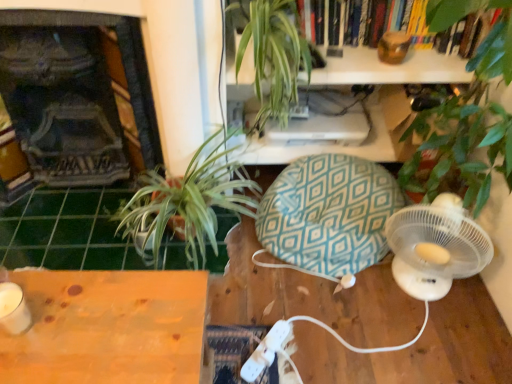
What do you see at coordinates (187, 204) in the screenshot?
I see `green leafy plant at left` at bounding box center [187, 204].

Describe the element at coordinates (274, 57) in the screenshot. I see `green leafy plant at upper center` at that location.

Locate an element on the screen. This screenshot has width=512, height=384. green leafy plant at upper center is located at coordinates (274, 57).

The height and width of the screenshot is (384, 512). What do you see at coordinates (78, 95) in the screenshot?
I see `dark gray stone fireplace at left` at bounding box center [78, 95].

You are a GUI agent. You are given a task and a screenshot of the screen. Output one action in this format:
    pyautogui.click(x=<x>, y=<y>)
    Task: Click on the wooden table at lower left
    This screenshot has height=384, width=512.
    Given the screenshot: What is the action you would take?
    pyautogui.click(x=108, y=327)

This screenshot has width=512, height=384. What are the coordinates of `green leafy plant at left` in the screenshot? It's located at (187, 204).

From a real-world perspective, is green leafy plant at upper center physically located above or below green leafy plant at left?

From a real-world perspective, green leafy plant at upper center is physically above green leafy plant at left.

In the scene shown: Is green leafy plant at upper center oriented away from green leafy plant at left?

No, green leafy plant at upper center is not facing away from green leafy plant at left.

Considering the sizes of objects green leafy plant at upper center and green leafy plant at left in the image provided, who is smaller, green leafy plant at upper center or green leafy plant at left?

With smaller size is green leafy plant at upper center.

How many degrees apart are the facing directions of green leafy plant at upper center and green leafy plant at left?

green leafy plant at upper center and green leafy plant at left are facing 0.678 degrees away from each other.

Considering the points (108, 210) and (261, 369), which point is in front, point (108, 210) or point (261, 369)?

The point (261, 369) is closer to the camera.

From a real-world perspective, which object rests below the other?

From a 3D spatial view, green tile at lower left is below.

The image size is (512, 384). I want to click on Wii controller on the right of green tile at lower left, so click(x=266, y=351).

How far apart are green tile at lower left and white plastic wii controller at lower center?

green tile at lower left is 77.84 centimeters from white plastic wii controller at lower center.

Is green leafy plant at left not close to teal diamond-patterned bean bag chair at center?

That's not correct — green leafy plant at left is a little close to teal diamond-patterned bean bag chair at center.

Which point is more distant from viewer, [146,193] or [321,243]?

Point [321,243]

Looking at this image, do you think green leafy plant at left is within teal diamond-patterned bean bag chair at center, or outside of it?

green leafy plant at left lies outside teal diamond-patterned bean bag chair at center.

Is green leafy plant at left to the left or to the right of teal diamond-patterned bean bag chair at center in the image?

Clearly, green leafy plant at left is on the left of teal diamond-patterned bean bag chair at center in the image.

Is point (241, 371) positioned after point (103, 177)?

No, it is in front of (103, 177).

Is white plastic wii controller at lower center wider or thinner than dark gray stone fireplace at left?

In the image, white plastic wii controller at lower center appears to be more narrow than dark gray stone fireplace at left.

From the image's perspective, which is above, white plastic wii controller at lower center or dark gray stone fireplace at left?

dark gray stone fireplace at left, from the image's perspective.

Is white plastic wii controller at lower center to the left of dark gray stone fireplace at left from the viewer's perspective?

Incorrect, white plastic wii controller at lower center is not on the left side of dark gray stone fireplace at left.

Is there a large distance between dark gray stone fireplace at left and white plastic fan at lower right?

Yes, dark gray stone fireplace at left and white plastic fan at lower right are quite far apart.

Between dark gray stone fireplace at left and white plastic fan at lower right, which one has larger width?

dark gray stone fireplace at left.

Is point (79, 144) positioned before point (412, 248)?

No, (79, 144) is behind (412, 248).

How different are the orientations of dark gray stone fireplace at left and white plastic fan at lower right in degrees?

The angular difference between dark gray stone fireplace at left and white plastic fan at lower right is 24.8 degrees.

Relative to green leafy plant at upper center, is wooden table at lower left in front or behind?

Clearly, wooden table at lower left is in front of green leafy plant at upper center.

Is wooden table at lower left oriented towards green leafy plant at upper center?

No, wooden table at lower left is not oriented towards green leafy plant at upper center.

Can you tell me how much wooden table at lower left and green leafy plant at upper center differ in facing direction?

wooden table at lower left and green leafy plant at upper center are facing 86.6 degrees away from each other.

Is wooden table at lower left touching green leafy plant at upper center?

No, wooden table at lower left is not beside green leafy plant at upper center.

Is the depth of green leafy plant at left greater than that of white plastic fan at lower right?

Yes, the depth of green leafy plant at left is greater than that of white plastic fan at lower right.

Would you say white plastic fan at lower right is part of green leafy plant at left's contents?

Actually, white plastic fan at lower right is outside green leafy plant at left.

From a real-world perspective, which object stands above the other?

white plastic fan at lower right.

Is green leafy plant at left bigger than white plastic fan at lower right?

Indeed, green leafy plant at left has a larger size compared to white plastic fan at lower right.

Find the location of a particular element. This screenshot has width=512, height=384. houseplant below the green leafy plant at upper center (from a real-world perspective) is located at coordinates (187, 204).

You are a GUI agent. You are given a task and a screenshot of the screen. Output one action in this format:
    pyautogui.click(x=<x>, y=<y>)
    Task: Click on the Wii controller in front of the green tile at lower left
    This screenshot has width=512, height=384.
    Given the screenshot: What is the action you would take?
    pyautogui.click(x=266, y=351)

Estimate the real-world distances between objects in this image. Which object is further from green tile at lower left, teal diamond-patterned bean bag chair at center or dark gray stone fireplace at left?

Among the two, teal diamond-patterned bean bag chair at center is located further to green tile at lower left.

Which object lies further to the anchor point wooden table at lower left, dark gray stone fireplace at left or green leafy plant at upper center?

The object further to wooden table at lower left is green leafy plant at upper center.

From the image, which object appears to be farther from white plastic fan at lower right, green tile at lower left or green leafy plant at left?

green tile at lower left is positioned further to the anchor white plastic fan at lower right.

When comparing their distances from wooden table at lower left, does green leafy plant at upper center or green leafy plant at left seem closer?

green leafy plant at left is closer to wooden table at lower left.

Considering their positions, is white plastic wii controller at lower center positioned further to wooden table at lower left than green leafy plant at left?

green leafy plant at left.

Based on their spatial positions, is wooden table at lower left or teal diamond-patterned bean bag chair at center closer to green tile at lower left?

teal diamond-patterned bean bag chair at center is closer to green tile at lower left.

Which object lies nearer to the anchor point teal diamond-patterned bean bag chair at center, white plastic wii controller at lower center or white plastic fan at lower right?

Among the two, white plastic fan at lower right is located nearer to teal diamond-patterned bean bag chair at center.

When comparing their distances from white plastic wii controller at lower center, does green leafy plant at upper center or teal diamond-patterned bean bag chair at center seem closer?

teal diamond-patterned bean bag chair at center.

Image resolution: width=512 pixels, height=384 pixels. Identify the location of houseplant situated between wooden table at lower left and white plastic fan at lower right from left to right. (187, 204).

The width and height of the screenshot is (512, 384). I want to click on houseplant between green tile at lower left and white plastic wii controller at lower center, so click(187, 204).

The width and height of the screenshot is (512, 384). I want to click on houseplant situated between dark gray stone fireplace at left and green leafy plant at upper center from left to right, so click(187, 204).

I want to click on vegetation between wooden table at lower left and white plastic fan at lower right, so click(274, 57).